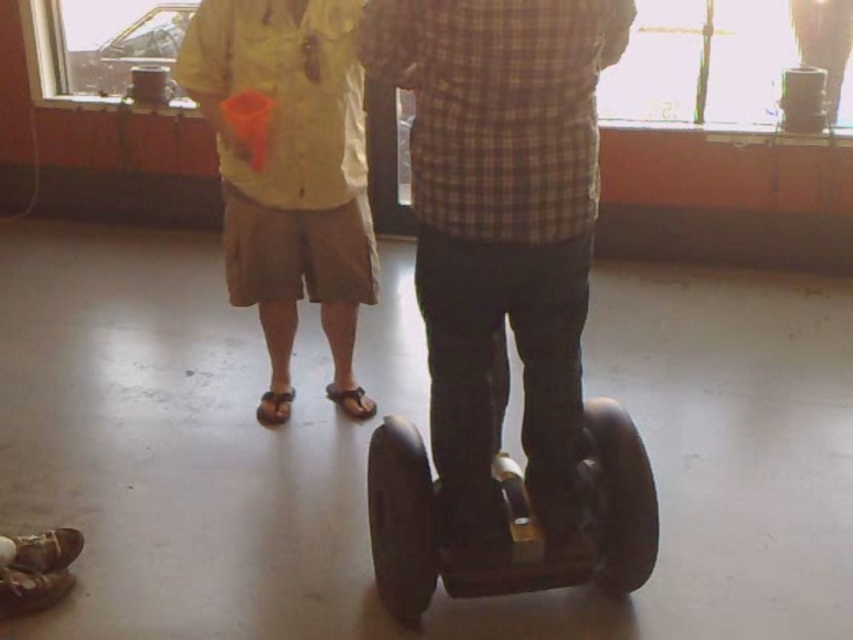
Is plaid shirt at center to the left of matte yellow shirt at center from the viewer's perspective?

Incorrect, plaid shirt at center is not on the left side of matte yellow shirt at center.

Which is more to the left, plaid shirt at center or matte yellow shirt at center?

From the viewer's perspective, matte yellow shirt at center appears more on the left side.

Does point (563, 353) come farther from viewer compared to point (273, 336)?

No, (563, 353) is in front of (273, 336).

Find the location of `plaid shirt at center`. plaid shirt at center is located at coordinates (502, 228).

Does plaid shirt at center have a lesser width compared to black rubber segway at center?

Correct, plaid shirt at center's width is less than black rubber segway at center's.

From the picture: Between plaid shirt at center and black rubber segway at center, which one is positioned higher?

plaid shirt at center

Does point (434, 392) lie in front of point (447, 593)?

Yes.

Where is `plaid shirt at center`? The image size is (853, 640). plaid shirt at center is located at coordinates (502, 228).

Between matte yellow shirt at center and black rubber segway at center, which one appears on the left side from the viewer's perspective?

Positioned to the left is matte yellow shirt at center.

How distant is matte yellow shirt at center from black rubber segway at center?

matte yellow shirt at center and black rubber segway at center are 37.01 inches apart.

Does point (331, 88) come farther from viewer compared to point (527, 532)?

Yes, it is.

The width and height of the screenshot is (853, 640). What are the coordinates of `matte yellow shirt at center` in the screenshot? It's located at (289, 176).